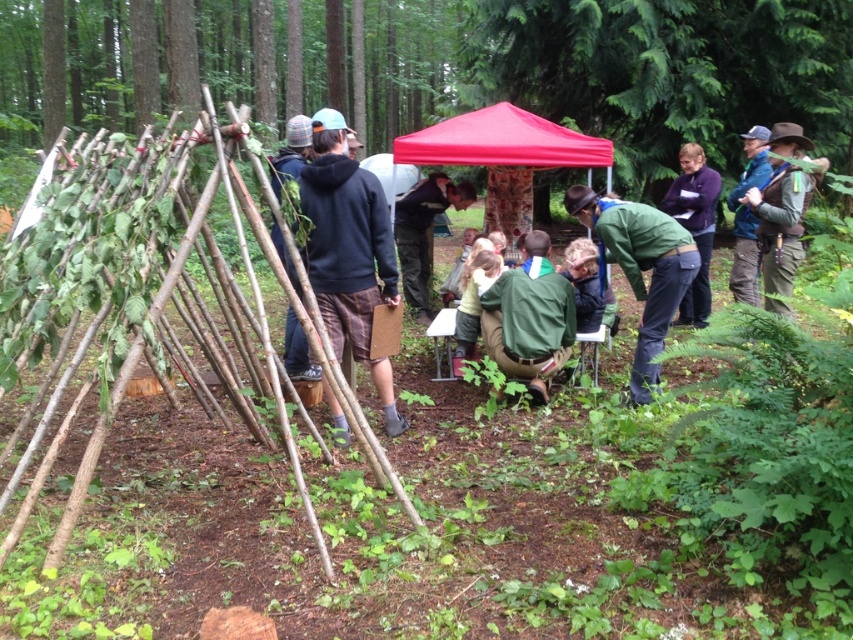
Question: Which point is farther to the camera?

Choices:
 (A) (335, 301)
 (B) (651, 349)
 (C) (310, 380)

Answer: (C)

Question: Among these objects, which one is nearest to the camera?

Choices:
 (A) green fabric jacket at center
 (B) dark purple sweater at center
 (C) red fabric tent at center

Answer: (A)

Question: Which point is closer to the camera taking this photo?

Choices:
 (A) (289, 256)
 (B) (703, 209)
 (C) (751, 180)

Answer: (A)

Question: From the image, what is the correct spatial relationship of brown leather hat at upper right in relation to light brown fabric at center?

Choices:
 (A) below
 (B) above

Answer: (B)

Question: Is light brown fabric at center bigger than blue-green fabric jacket at upper right?

Choices:
 (A) yes
 (B) no

Answer: (B)

Question: Does red fabric tent at center have a greater width compared to brown leather hat at upper right?

Choices:
 (A) yes
 (B) no

Answer: (A)